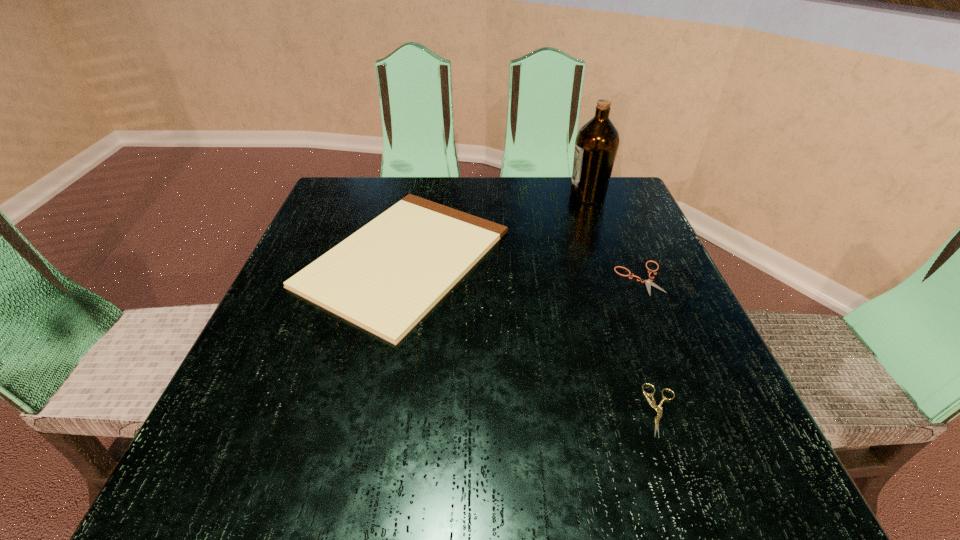
You are a GUI agent. You are given a task and a screenshot of the screen. Output one action in this format:
    pyautogui.click(x=<x>, y=<y>)
    Task: Click on the vacant space that is in between the farther shears and the leftmost object
    This screenshot has height=540, width=960.
    Given the screenshot: What is the action you would take?
    [x=522, y=268]

Identify the location of empty space between the nearest object and the farther shears. (652, 345).

Find the location of a particular element. The height and width of the screenshot is (540, 960). vacant space in between the farther shears and the leftmost object is located at coordinates point(522,268).

This screenshot has height=540, width=960. I want to click on vacant space that's between the olive oil and the nearest object, so click(625, 303).

Identify which object is located as the second nearest to the farther shears. Please provide its 2D coordinates. Your answer should be formatted as a tuple, i.e. [(x, y)], where the tuple contains the x and y coordinates of a point satisfying the conditions above.

[(385, 277)]

You are a GUI agent. You are given a task and a screenshot of the screen. Output one action in this format:
    pyautogui.click(x=<x>, y=<y>)
    Task: Click on the object that stands as the third closest to the nearest object
    Image resolution: width=960 pixels, height=540 pixels.
    Given the screenshot: What is the action you would take?
    pyautogui.click(x=597, y=142)

Where is `free point that satisfies the following two spatial constraints: 1. on the back side of the farther shears; 2. on the label of the tallest object`? free point that satisfies the following two spatial constraints: 1. on the back side of the farther shears; 2. on the label of the tallest object is located at coordinates (606, 195).

You are a GUI agent. You are given a task and a screenshot of the screen. Output one action in this format:
    pyautogui.click(x=<x>, y=<y>)
    Task: Click on the blank space that satisfies the following two spatial constraints: 1. on the back side of the farther shears; 2. on the label of the olive oil
    This screenshot has width=960, height=540.
    Given the screenshot: What is the action you would take?
    pyautogui.click(x=606, y=195)

Where is `free location that satisfies the following two spatial constraints: 1. on the label of the farther shears; 2. on the right side of the olive oil`? Image resolution: width=960 pixels, height=540 pixels. free location that satisfies the following two spatial constraints: 1. on the label of the farther shears; 2. on the right side of the olive oil is located at coordinates (617, 278).

This screenshot has height=540, width=960. Identify the location of vacant space that satisfies the following two spatial constraints: 1. on the label of the tallest object; 2. on the right side of the farther shears. (617, 278).